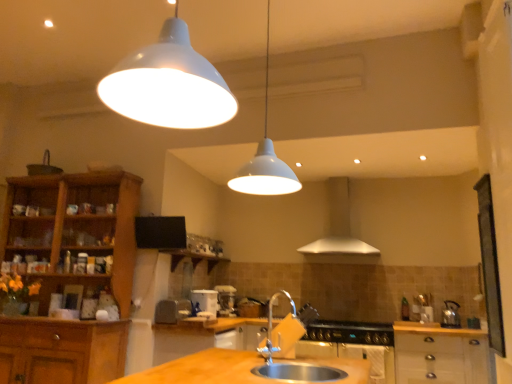
Question: Relative to silver metallic sink at lower center, is black matte gas stove at lower center in front or behind?

Choices:
 (A) front
 (B) behind

Answer: (B)

Question: Is black matte gas stove at lower center wider or thinner than silver metallic sink at lower center?

Choices:
 (A) thin
 (B) wide

Answer: (B)

Question: Estimate the real-world distances between objects in this image. Which object is closer to the wooden cabinet at lower right, placed as the second cabinetry when sorted from left to right?

Choices:
 (A) satin nickel faucet at sink center
 (B) black matte gas stove at lower center
 (C) stainless steel oven at lower center
 (D) white matte pendant light at upper center
 (E) polished stainless steel kettle at right, which is the 2th appliance from front to back

Answer: (C)

Question: Which object is the farthest from the silver metallic sink at lower center?

Choices:
 (A) wooden cabinet at lower right, positioned as the first cabinetry in right-to-left order
 (B) satin nickel faucet at sink center
 (C) white matte pendant light at upper center
 (D) silver metallic exhaust hood at center
 (E) matte plastic toaster at center, arranged as the second appliance when viewed from the back

Answer: (D)